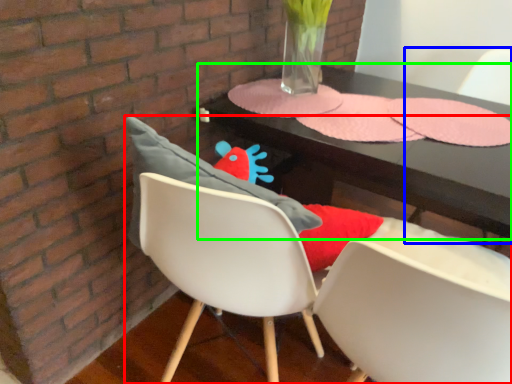
Question: Which object is positioned closest to chair (highlighted by a red box)? Select from armchair (highlighted by a blue box) and table (highlighted by a green box).

Choices:
 (A) armchair
 (B) table

Answer: (B)